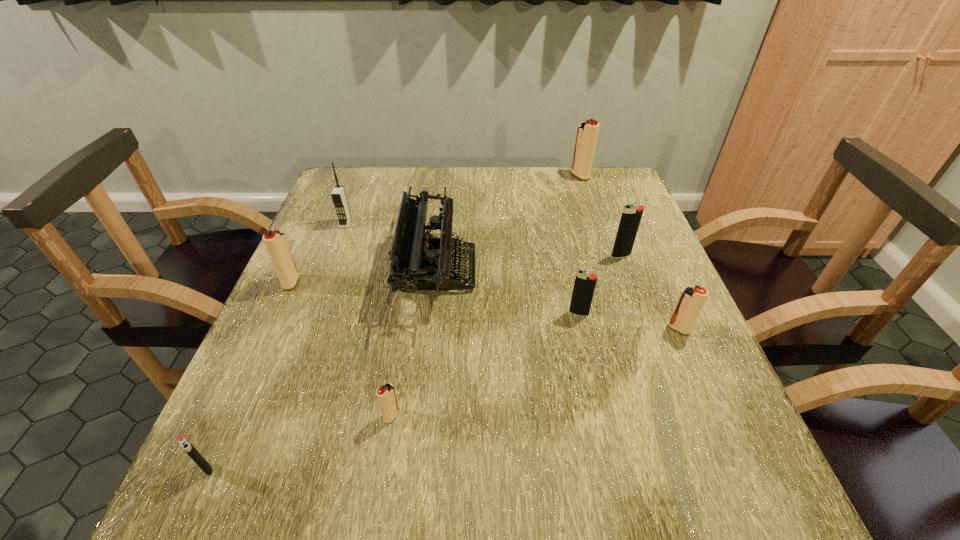
At what (x,y) coordinates should I click in order to perform the action: click on vacant area that lies between the second farthest red igniter and the third igniter from left to right. Please return your answer as a coordinate pair (x, y). The image size is (960, 540). Looking at the image, I should click on (342, 349).

Find the location of a particular element. The width and height of the screenshot is (960, 540). free spot between the nearest object and the second nearest igniter is located at coordinates (300, 442).

Locate an element on the screen. This screenshot has width=960, height=540. free space between the third object from left to right and the rightmost object is located at coordinates click(512, 276).

At what (x,y) coordinates should I click in order to perform the action: click on free point between the farthest object and the second smallest black igniter. Please return your answer as a coordinate pair (x, y). Looking at the image, I should click on (580, 245).

Where is `free space between the second black igniter from right to left and the eighth farthest object`? This screenshot has width=960, height=540. free space between the second black igniter from right to left and the eighth farthest object is located at coordinates (485, 364).

Where is `object that is the closest to the farthest igniter`? This screenshot has height=540, width=960. object that is the closest to the farthest igniter is located at coordinates (631, 216).

This screenshot has height=540, width=960. In order to click on object that is the second closest to the leftmost black igniter in this screenshot , I will do `click(419, 262)`.

Locate which igniter ranks in proximity to the typewriter. Please provide its 2D coordinates. Your answer should be formatted as a tuple, i.e. [(x, y)], where the tuple contains the x and y coordinates of a point satisfying the conditions above.

[(386, 396)]

Point out which igniter is positioned as the sixth nearest to the third object from left to right. Please provide its 2D coordinates. Your answer should be formatted as a tuple, i.e. [(x, y)], where the tuple contains the x and y coordinates of a point satisfying the conditions above.

[(631, 216)]

Identify the location of the closest red igniter relative to the cellular telephone. (276, 244).